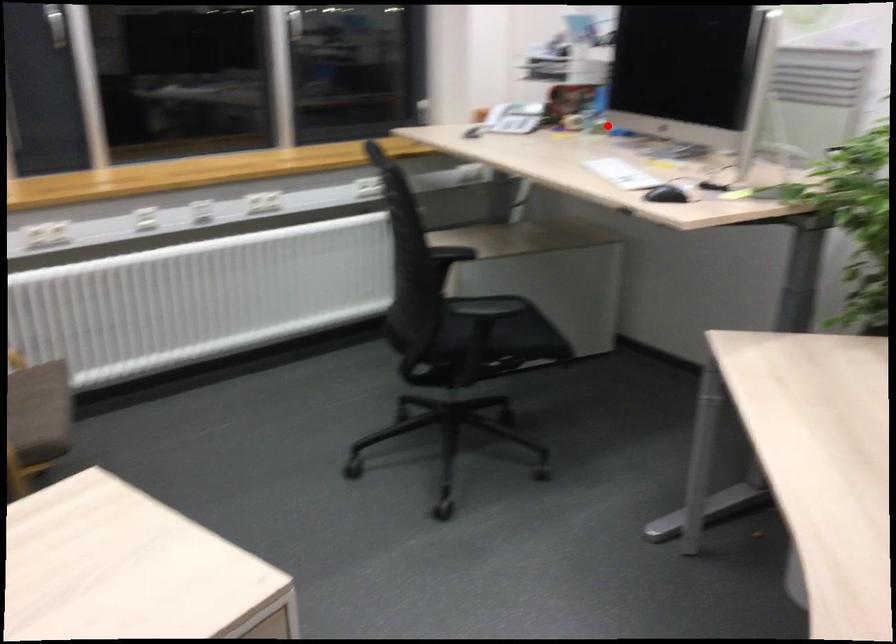
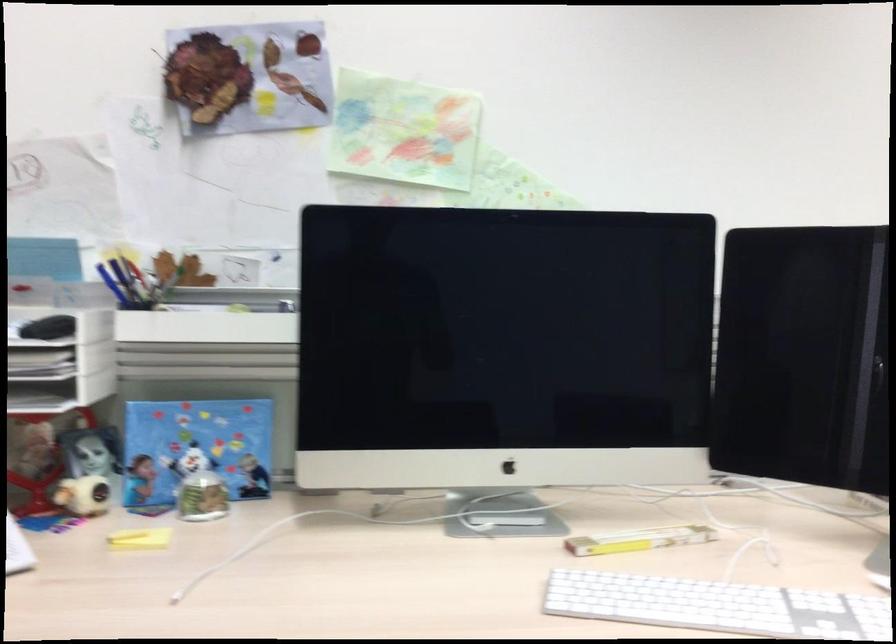
Question: A red point is marked in image1. In image2, is the corresponding 3D point closer to the camera or farther? Reply with the corresponding letter.

Choices:
 (A) The corresponding 3D point is closer.
 (B) The corresponding 3D point is farther.

Answer: (A)